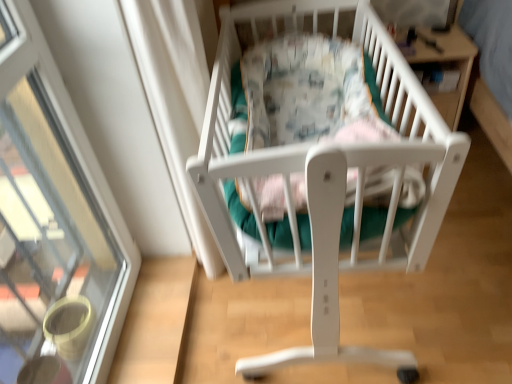
Question: Is wooden table at upper right not inside transparent glass door at upper left?

Choices:
 (A) yes
 (B) no

Answer: (A)

Question: Could you tell me if wooden table at upper right is turned towards transparent glass door at upper left?

Choices:
 (A) no
 (B) yes

Answer: (A)

Question: Does wooden table at upper right have a larger size compared to transparent glass door at upper left?

Choices:
 (A) no
 (B) yes

Answer: (A)

Question: From a real-world perspective, is wooden table at upper right on top of transparent glass door at upper left?

Choices:
 (A) no
 (B) yes

Answer: (A)

Question: Does wooden table at upper right appear on the left side of transparent glass door at upper left?

Choices:
 (A) no
 (B) yes

Answer: (A)

Question: Considering the relative sizes of wooden table at upper right and transparent glass door at upper left in the image provided, is wooden table at upper right shorter than transparent glass door at upper left?

Choices:
 (A) yes
 (B) no

Answer: (A)

Question: Can you confirm if white matte infant bed at center is bigger than wooden table at upper right?

Choices:
 (A) yes
 (B) no

Answer: (A)

Question: Can you confirm if white matte infant bed at center is taller than wooden table at upper right?

Choices:
 (A) yes
 (B) no

Answer: (B)

Question: From the image's perspective, does white matte infant bed at center appear lower than wooden table at upper right?

Choices:
 (A) yes
 (B) no

Answer: (A)

Question: Does white matte infant bed at center have a greater width compared to wooden table at upper right?

Choices:
 (A) no
 (B) yes

Answer: (B)

Question: From a real-world perspective, is white matte infant bed at center positioned under wooden table at upper right based on gravity?

Choices:
 (A) yes
 (B) no

Answer: (A)

Question: Can you confirm if white matte infant bed at center is positioned to the right of wooden table at upper right?

Choices:
 (A) no
 (B) yes

Answer: (A)

Question: Is white matte infant bed at center bigger than transparent glass door at upper left?

Choices:
 (A) no
 (B) yes

Answer: (B)